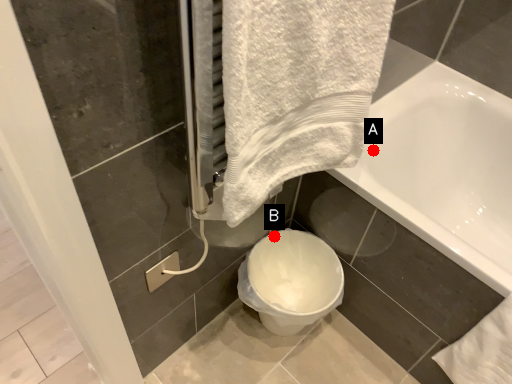
Question: Two points are circled on the image, labeled by A and B beside each circle. Which point is farther from the camera taking this photo?

Choices:
 (A) A is further
 (B) B is further

Answer: (B)